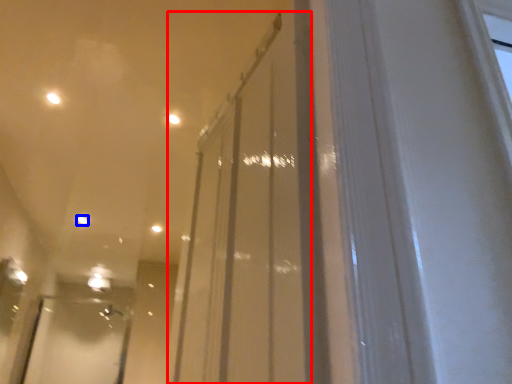
Question: Which point is closer to the camera, glass door (highlighted by a red box) or light (highlighted by a blue box)?

Choices:
 (A) glass door
 (B) light

Answer: (A)